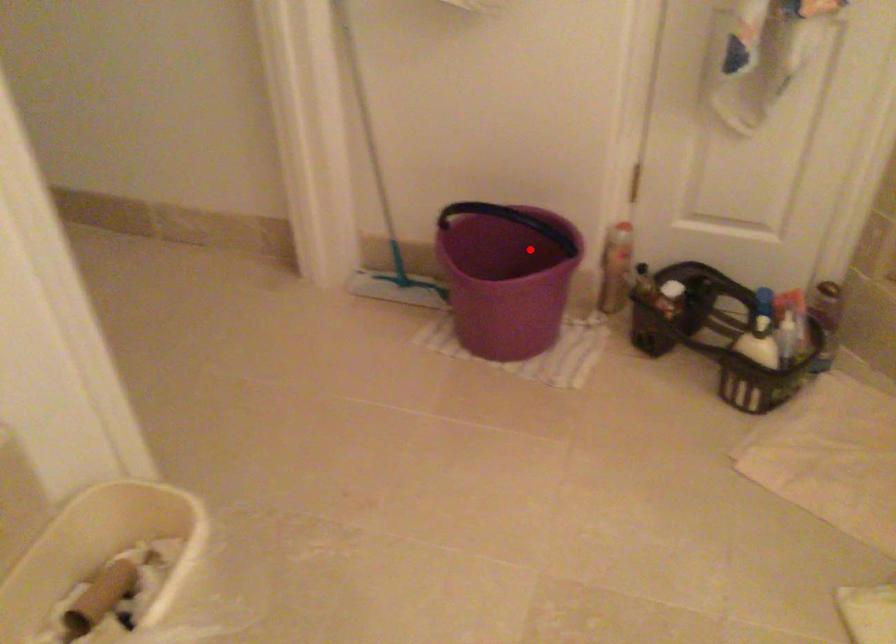
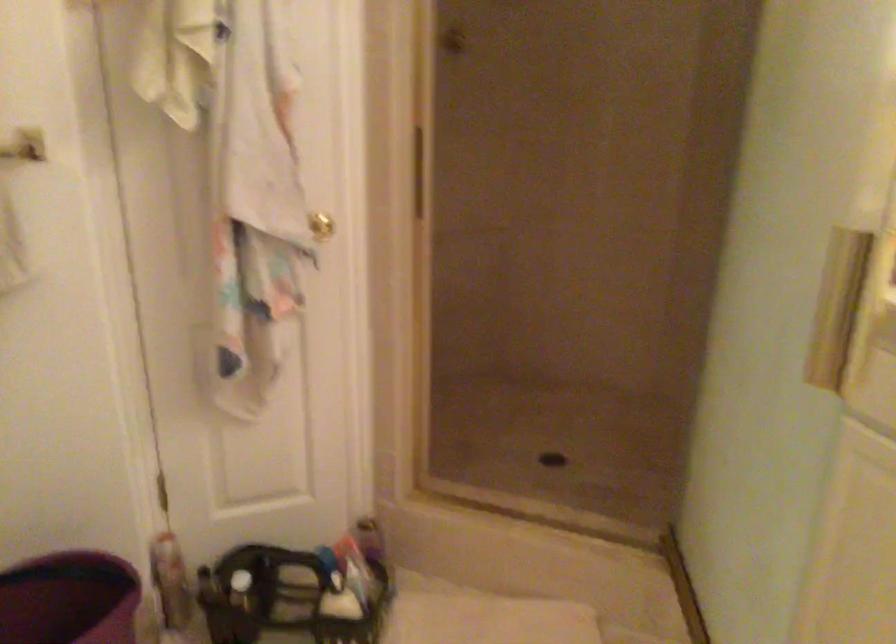
Question: I am providing you with two images of the same scene from different viewpoints. A red point is shown in image1. For the corresponding object point in image2, is it positioned nearer or farther from the camera?

Choices:
 (A) Nearer
 (B) Farther

Answer: (A)